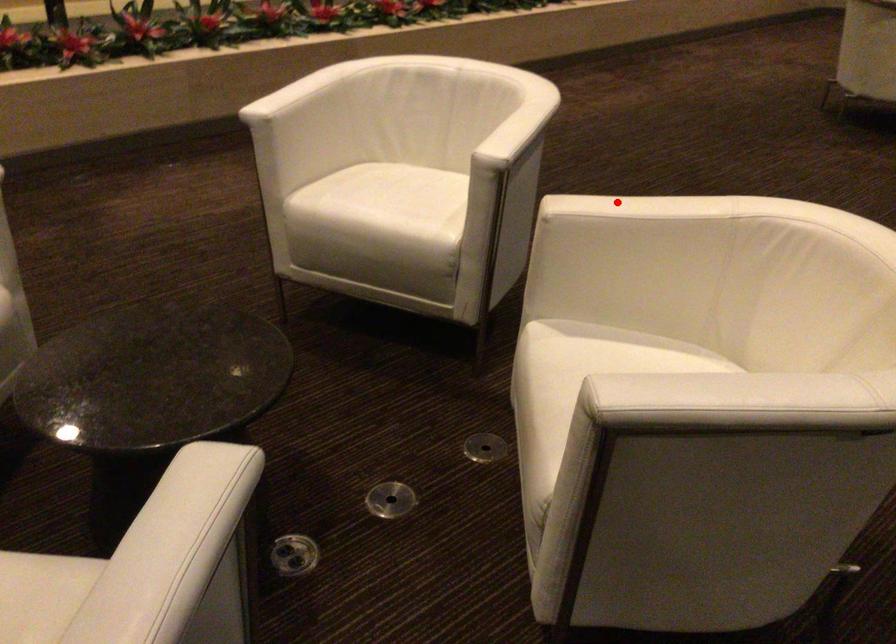
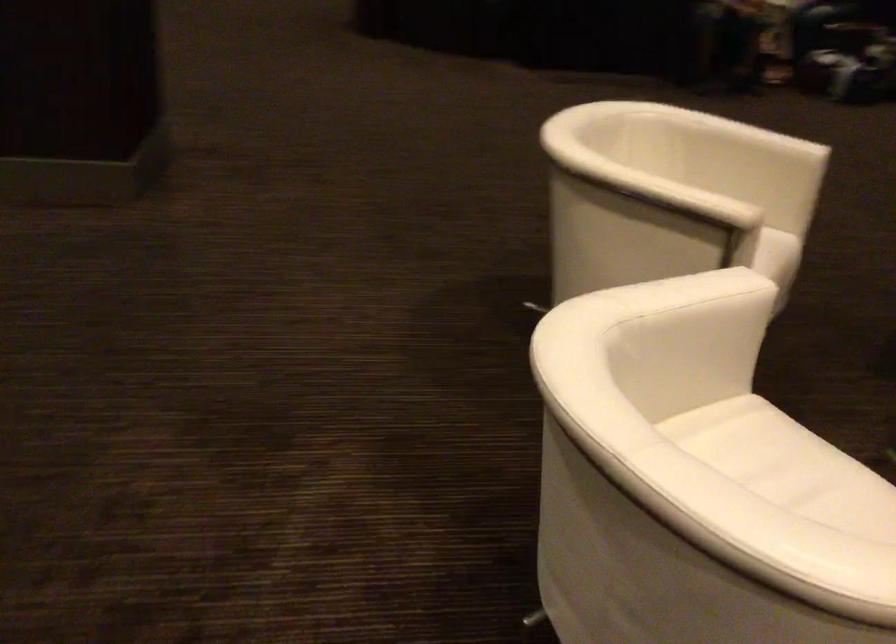
Question: A red point is marked in image1. In image2, is the corresponding 3D point closer to the camera or farther? Reply with the corresponding letter.

Choices:
 (A) The corresponding 3D point is closer.
 (B) The corresponding 3D point is farther.

Answer: (B)